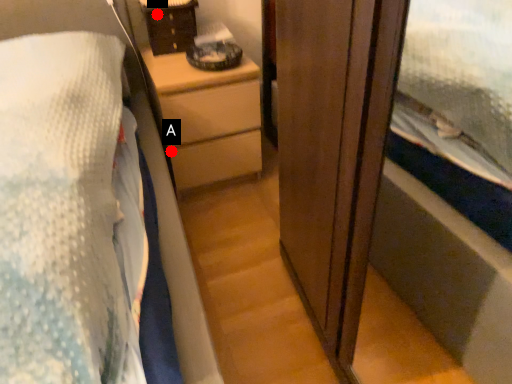
Question: Two points are circled on the image, labeled by A and B beside each circle. Which of the following is the farthest from the observer?

Choices:
 (A) A is further
 (B) B is further

Answer: (A)